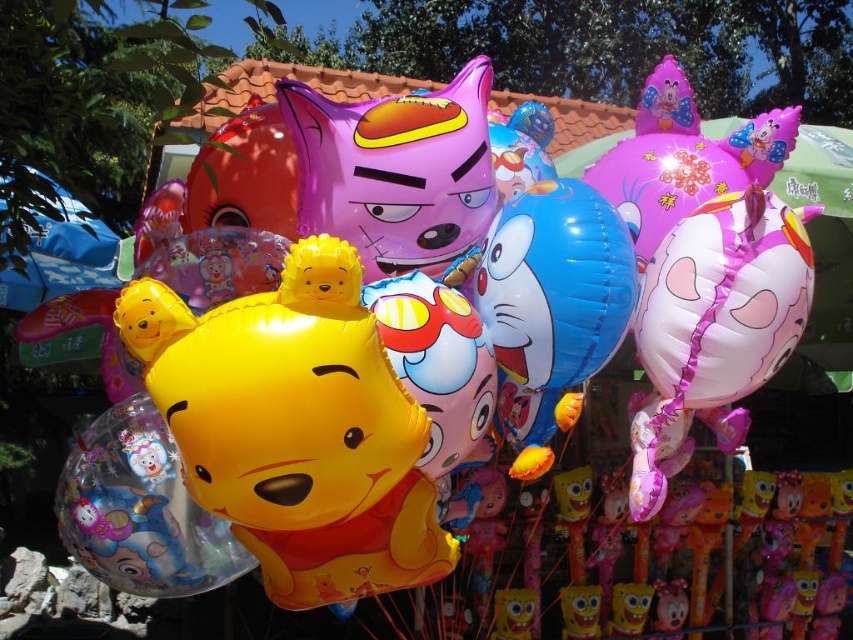
Is yellow matte winnie the pooh balloon at center positioned at the back of pink glossy pig at upper right?

No.

Does point (334, 387) come behind point (773, 237)?

No, (334, 387) is in front of (773, 237).

This screenshot has width=853, height=640. I want to click on yellow matte winnie the pooh balloon at center, so click(296, 428).

Does pink glossy pig at upper right have a lesser height compared to blue glossy balloon at center?

No.

Does pink glossy pig at upper right come in front of blue glossy balloon at center?

No, it is not.

You are a GUI agent. You are given a task and a screenshot of the screen. Output one action in this format:
    pyautogui.click(x=<x>, y=<y>)
    Task: Click on the pink glossy pig at upper right
    
    Given the screenshot: What is the action you would take?
    pyautogui.click(x=724, y=300)

Identify the location of pink glossy pig at upper right. This screenshot has height=640, width=853. (724, 300).

Is purple glossy balloon at center to the left of pink glossy pig at upper right from the viewer's perspective?

Correct, you'll find purple glossy balloon at center to the left of pink glossy pig at upper right.

Is purple glossy balloon at center to the right of pink glossy pig at upper right from the viewer's perspective?

Incorrect, purple glossy balloon at center is not on the right side of pink glossy pig at upper right.

At what (x,y) coordinates should I click in order to perform the action: click on purple glossy balloon at center. Please return your answer as a coordinate pair (x, y). Looking at the image, I should click on (397, 172).

The width and height of the screenshot is (853, 640). Identify the location of purple glossy balloon at center. (397, 172).